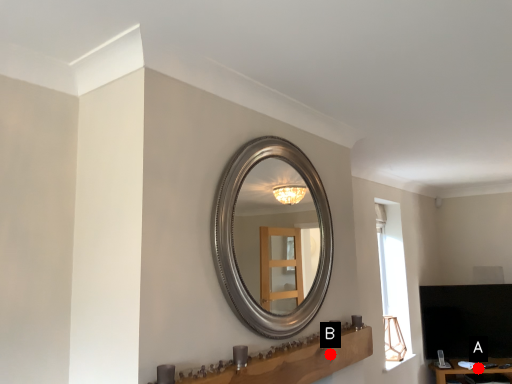
Question: Two points are circled on the image, labeled by A and B beside each circle. Which point is farther to the camera?

Choices:
 (A) A is further
 (B) B is further

Answer: (A)